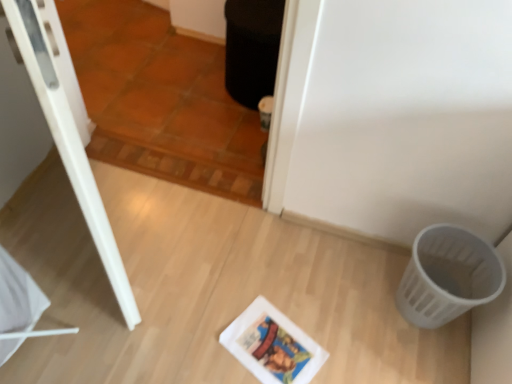
Where is `free space that is to the left of white plastic basket at lower right`? This screenshot has height=384, width=512. free space that is to the left of white plastic basket at lower right is located at coordinates (350, 302).